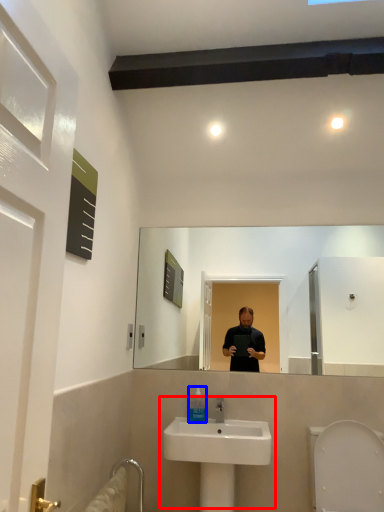
Question: Among these objects, which one is nearest to the camera, sink (highlighted by a red box) or mouthwash (highlighted by a blue box)?

Choices:
 (A) sink
 (B) mouthwash

Answer: (A)